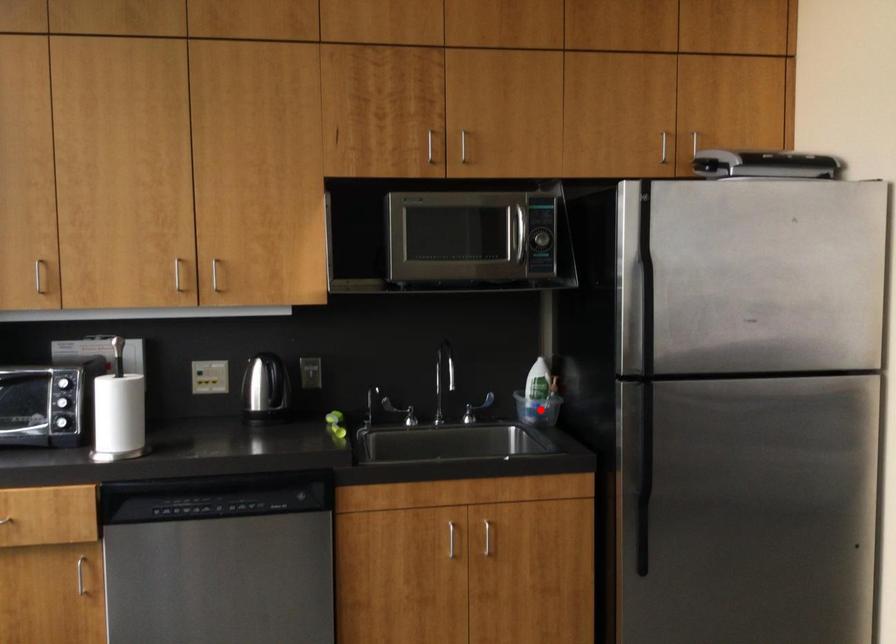
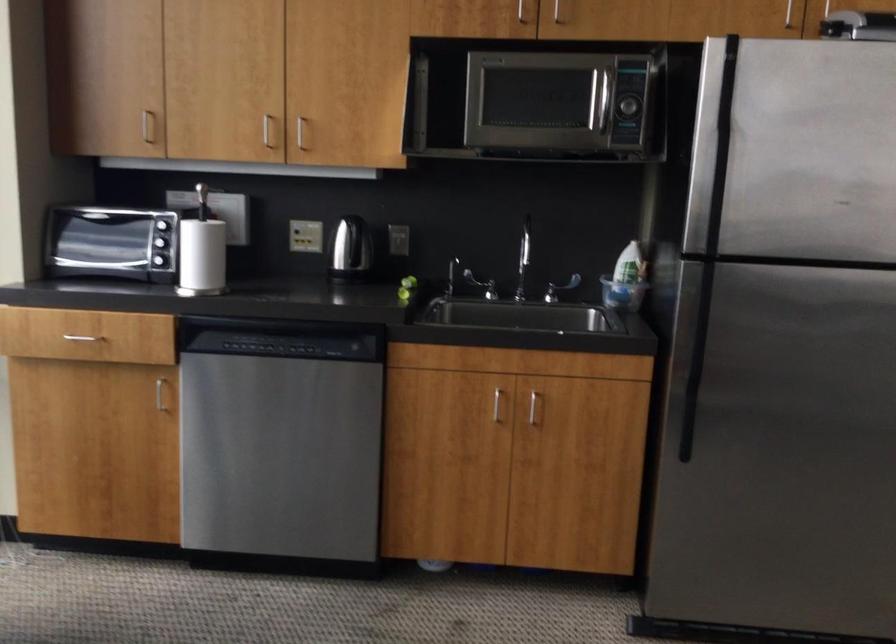
The point at the highlighted location is marked in the first image. Where is the corresponding point in the second image?

(622, 294)